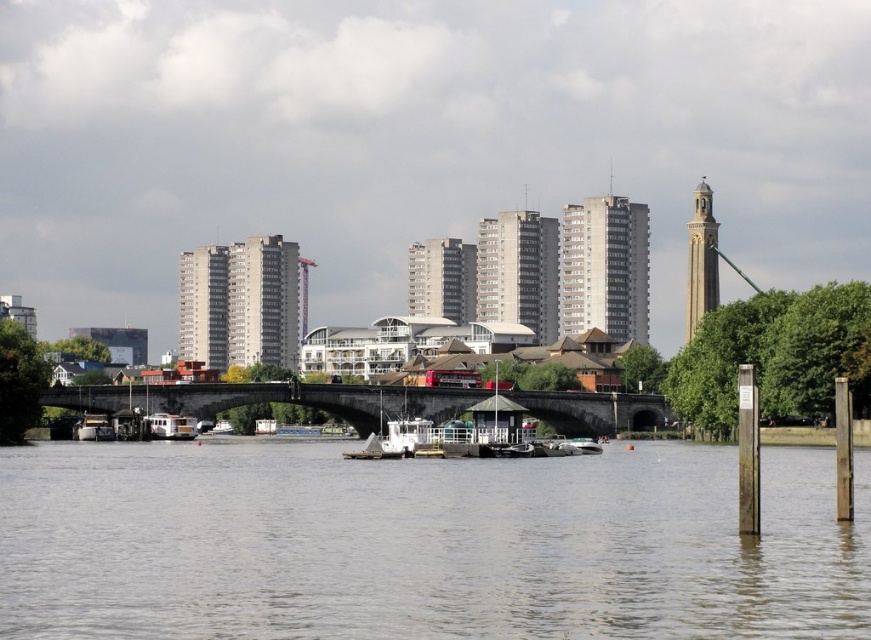
Is stone bridge at center bigger than white matte boat at center?

Yes.

Which is in front, point (356, 417) or point (176, 429)?

Point (176, 429) is in front.

Is point (319, 401) farther from viewer compared to point (188, 435)?

Yes, it is behind point (188, 435).

The height and width of the screenshot is (640, 871). Identify the location of stone bridge at center. (272, 400).

Measure the distance between gray water at center and stone bridge at center.

134.35 feet

Can you confirm if gray water at center is taller than stone bridge at center?

In fact, gray water at center may be shorter than stone bridge at center.

At what (x,y) coordinates should I click in order to perform the action: click on gray water at center. Please return your answer as a coordinate pair (x, y). The image size is (871, 640). Looking at the image, I should click on (423, 545).

Find the location of a particular element. The image size is (871, 640). gray water at center is located at coordinates (423, 545).

Is the position of gray water at center more distant than that of white matte boat at center?

No, it is in front of white matte boat at center.

Does point (386, 548) come in front of point (179, 435)?

Yes, it is.

Image resolution: width=871 pixels, height=640 pixels. I want to click on gray water at center, so click(x=423, y=545).